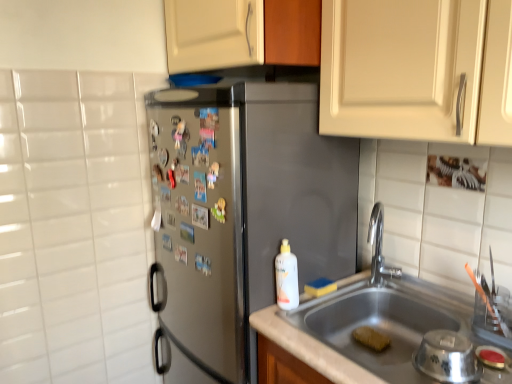
Describe the element at coordinates (383, 316) in the screenshot. Image resolution: width=512 pixels, height=384 pixels. I see `stainless steel sink at lower right` at that location.

Describe the element at coordinates (241, 33) in the screenshot. I see `matte white cabinet at upper center` at that location.

Identify the location of stainless steel bowl at sink. The width and height of the screenshot is (512, 384). (447, 357).

Find the location of a particular element. yellow sponge at sink, which is the 1th food in left-to-right order is located at coordinates (320, 287).

Locate an element on the screen. The width and height of the screenshot is (512, 384). white matte bottle at sink is located at coordinates [286, 277].

I want to click on stainless steel sink at lower right, so click(383, 316).

From a real-world perspective, which object stands above the other?

white matte bottle at sink is physically above.

This screenshot has height=384, width=512. Find the location of `the 2nd food to the right of the white matte bottle at sink, starting your count from the anchor`. the 2nd food to the right of the white matte bottle at sink, starting your count from the anchor is located at coordinates (371, 338).

Does point (378, 344) come farther from viewer compared to point (284, 286)?

That is True.

How different are the orientations of yellow sponge at sink bottom, which is the 1th food from right to left, and white matte bottle at sink in degrees?

There is a 1.71-degree angle between the facing directions of yellow sponge at sink bottom, which is the 1th food from right to left, and white matte bottle at sink.

Is yellow sponge at sink, the 2th food positioned from the bottom, further to the viewer compared to stainless steel sink at lower right?

Yes, it is.

Is point (320, 282) positioned after point (309, 327)?

Yes, it is.

In the scene shown: Is yellow sponge at sink, the 2th food positioned from the bottom, positioned far away from stainless steel sink at lower right?

No, yellow sponge at sink, the 2th food positioned from the bottom, is in close proximity to stainless steel sink at lower right.

From the picture: Is yellow sponge at sink, placed as the 1th food when sorted from top to bottom, to the left of stainless steel sink at lower right from the viewer's perspective?

Yes.

Is matte white cabinet at upper center wider or thinner than polished chrome faucet at sink right?

Clearly, matte white cabinet at upper center has more width compared to polished chrome faucet at sink right.

Can you confirm if matte white cabinet at upper center is bigger than polished chrome faucet at sink right?

Yes, matte white cabinet at upper center is bigger than polished chrome faucet at sink right.

Do you think matte white cabinet at upper center is within polished chrome faucet at sink right, or outside of it?

matte white cabinet at upper center is not inside polished chrome faucet at sink right, it's outside.

Based on their positions, is matte white cabinet at upper center located to the left or right of polished chrome faucet at sink right?

In the image, matte white cabinet at upper center appears on the left side of polished chrome faucet at sink right.

From the image's perspective, is stainless steel sink at lower right located above matte white cabinet at upper center?

No, from the image's perspective, stainless steel sink at lower right is not on top of matte white cabinet at upper center.

Is stainless steel sink at lower right spatially inside matte white cabinet at upper center, or outside of it?

stainless steel sink at lower right is located beyond the bounds of matte white cabinet at upper center.

Consider the image. Between stainless steel sink at lower right and matte white cabinet at upper center, which one has larger size?

matte white cabinet at upper center is bigger.

Could you tell me if yellow sponge at sink, which is counted as the 2th food, starting from the right, is facing yellow sponge at sink bottom, which appears as the 2th food when viewed from the top?

No, yellow sponge at sink, which is counted as the 2th food, starting from the right, is not aimed at yellow sponge at sink bottom, which appears as the 2th food when viewed from the top.

Which is behind, yellow sponge at sink, which is counted as the 2th food, starting from the right, or yellow sponge at sink bottom, arranged as the first food when ordered from the bottom?

yellow sponge at sink, which is counted as the 2th food, starting from the right, is more distant.

Is yellow sponge at sink bottom, which is the 1th food from right to left, a part of yellow sponge at sink, placed as the 1th food when sorted from top to bottom?

Definitely not — yellow sponge at sink bottom, which is the 1th food from right to left, is not inside yellow sponge at sink, placed as the 1th food when sorted from top to bottom.

Is yellow sponge at sink, which is counted as the 2th food, starting from the right, taller or shorter than yellow sponge at sink bottom, which appears as the second food when viewed from the left?

In the image, yellow sponge at sink, which is counted as the 2th food, starting from the right, appears to be shorter than yellow sponge at sink bottom, which appears as the second food when viewed from the left.

In terms of width, does polished chrome faucet at sink right look wider or thinner when compared to stainless steel sink at lower right?

polished chrome faucet at sink right is thinner than stainless steel sink at lower right.

Is polished chrome faucet at sink right bigger than stainless steel sink at lower right?

No.

Considering the relative sizes of polished chrome faucet at sink right and stainless steel sink at lower right in the image provided, is polished chrome faucet at sink right shorter than stainless steel sink at lower right?

Incorrect, the height of polished chrome faucet at sink right does not fall short of that of stainless steel sink at lower right.

Does polished chrome faucet at sink right turn towards stainless steel sink at lower right?

No.

From the image's perspective, who appears lower, yellow sponge at sink, which is counted as the 2th food, starting from the right, or polished chrome faucet at sink right?

yellow sponge at sink, which is counted as the 2th food, starting from the right, appears lower in the image.

Is yellow sponge at sink, which is counted as the 2th food, starting from the right, outside of polished chrome faucet at sink right?

yellow sponge at sink, which is counted as the 2th food, starting from the right, lies outside polished chrome faucet at sink right's area.

Are yellow sponge at sink, the 2th food positioned from the bottom, and polished chrome faucet at sink right beside each other?

yellow sponge at sink, the 2th food positioned from the bottom, and polished chrome faucet at sink right are clearly separated.

Is point (314, 285) in front of point (376, 218)?

Yes, point (314, 285) is in front of point (376, 218).

Locate an element on the screen. This screenshot has height=384, width=512. cleaning product in front of the yellow sponge at sink bottom, which appears as the second food when viewed from the left is located at coordinates (286, 277).

Which food is the 2nd one when counting from the left side of the stainless steel sink at lower right? Please provide its 2D coordinates.

[(320, 287)]

Looking at the image, which one is located further to matte white cabinet at upper center, white matte bottle at sink or stainless steel sink at lower right?

stainless steel sink at lower right lies further to matte white cabinet at upper center than the other object.

Considering their positions, is satin steel refrigerator at center positioned further to yellow sponge at sink, placed as the 1th food when sorted from top to bottom, than polished chrome faucet at sink right?

satin steel refrigerator at center is positioned further to the anchor yellow sponge at sink, placed as the 1th food when sorted from top to bottom.

When comparing their distances from satin steel refrigerator at center, does stainless steel sink at lower right or yellow sponge at sink, placed as the 1th food when sorted from top to bottom, seem closer?

The object closer to satin steel refrigerator at center is stainless steel sink at lower right.

Considering their positions, is stainless steel bowl at sink positioned closer to yellow sponge at sink bottom, which appears as the second food when viewed from the left, than matte white cabinet at upper center?

Based on the image, stainless steel bowl at sink appears to be nearer to yellow sponge at sink bottom, which appears as the second food when viewed from the left.

Estimate the real-world distances between objects in this image. Which object is closer to yellow sponge at sink bottom, arranged as the first food when ordered from the bottom, polished chrome faucet at sink right or satin steel refrigerator at center?

polished chrome faucet at sink right is closer to yellow sponge at sink bottom, arranged as the first food when ordered from the bottom.

Which object lies further to the anchor point yellow sponge at sink, which is counted as the 2th food, starting from the right, stainless steel sink at lower right or white matte bottle at sink?

Based on the image, stainless steel sink at lower right appears to be further to yellow sponge at sink, which is counted as the 2th food, starting from the right.

From the image, which object appears to be nearer to yellow sponge at sink, which is the 1th food in left-to-right order, stainless steel bowl at sink or satin steel refrigerator at center?

Based on the image, satin steel refrigerator at center appears to be nearer to yellow sponge at sink, which is the 1th food in left-to-right order.

Which object lies further to the anchor point satin steel refrigerator at center, stainless steel bowl at sink or matte white cabinet at upper center?

stainless steel bowl at sink is further to satin steel refrigerator at center.

Find the location of a particular element. The width and height of the screenshot is (512, 384). food between white matte bottle at sink and yellow sponge at sink bottom, arranged as the first food when ordered from the bottom is located at coordinates (320, 287).

Locate an element on the screen. The image size is (512, 384). tap between stainless steel sink at lower right and yellow sponge at sink bottom, which is the 1th food from right to left, from front to back is located at coordinates (379, 248).

The height and width of the screenshot is (384, 512). Find the location of `food between matte white cabinet at upper center and yellow sponge at sink bottom, which appears as the 2th food when viewed from the top, in the up-down direction`. food between matte white cabinet at upper center and yellow sponge at sink bottom, which appears as the 2th food when viewed from the top, in the up-down direction is located at coordinates (320, 287).

Find the location of a particular element. This screenshot has width=512, height=384. cleaning product positioned between satin steel refrigerator at center and yellow sponge at sink, the 2th food positioned from the bottom, from near to far is located at coordinates (286, 277).